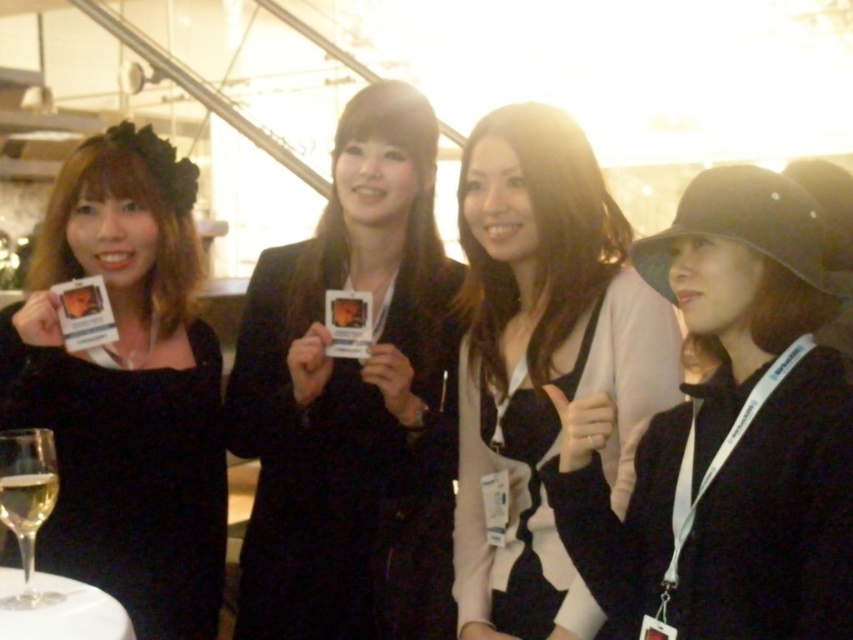
You are at a social event and need to place a napkin in the clear glass wine glass at lower left. Considering the clear glass wine at lower left is already inside, will the napkin fit inside without spilling the wine?

The clear glass wine glass at lower left might be wider than the clear glass wine at lower left, so there might be enough space to place the napkin inside without spilling the wine.

You are at a networking event and need to hand your card to the person holding the black matte hat at right. You have the black matte card at left in your hand. Can you directly hand them your card without moving closer?

The black matte hat at right is closer to the viewer than the black matte card at left, so you can directly hand them your card without needing to move closer.